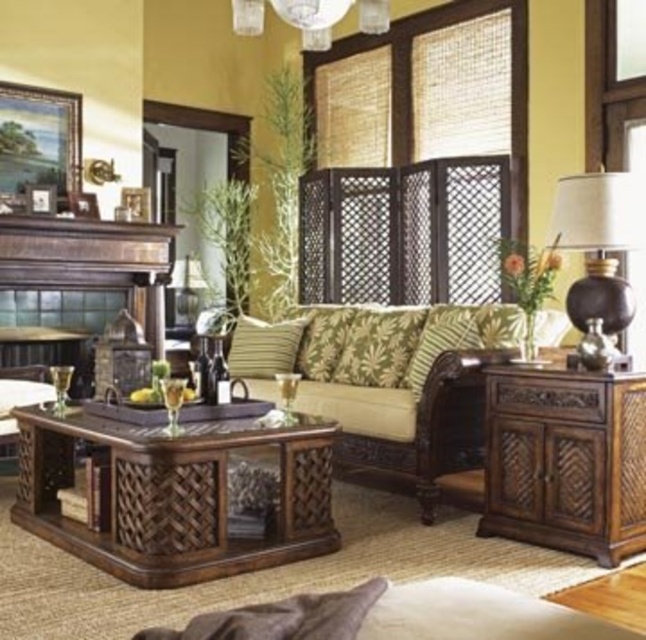
Consider the image. You are planning to place a rectangular rug in the living room. The rug must be placed between the brown woven table at center and the brown woven armchair at left. Considering their widths, which object should be placed closer to the wall to ensure the rug fits properly?

The brown woven table at center is wider than the brown woven armchair at left. To ensure the rug fits properly, the brown woven armchair at left should be placed closer to the wall since it has a narrower width compared to the table.

You are sitting on the brown woven armchair at left and want to pick up the green leafy fabric pillow at center. Can you reach it without moving from your seat?

The brown woven armchair at left is below the green leafy fabric pillow at center, so you can easily reach it while sitting in the chair.